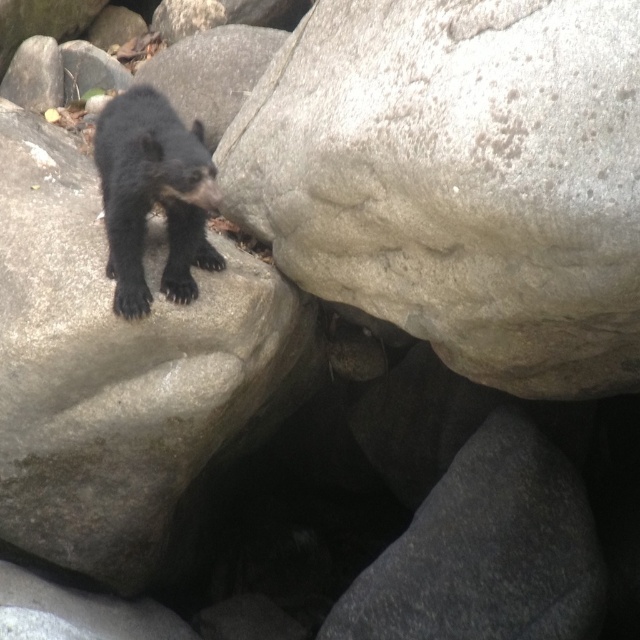
Does gray rough boulder at center appear on the right side of shiny black bear at upper left?

Indeed, gray rough boulder at center is positioned on the right side of shiny black bear at upper left.

Is the position of gray rough boulder at center more distant than that of shiny black bear at upper left?

No, gray rough boulder at center is closer to the viewer.

You are a GUI agent. You are given a task and a screenshot of the screen. Output one action in this format:
    pyautogui.click(x=<x>, y=<y>)
    Task: Click on the gray rough boulder at center
    This screenshot has width=640, height=640.
    Given the screenshot: What is the action you would take?
    pyautogui.click(x=458, y=179)

Between matte gray rock at center and shiny black bear at upper left, which one has less height?

shiny black bear at upper left is shorter.

Can you confirm if matte gray rock at center is positioned above shiny black bear at upper left?

No.

Image resolution: width=640 pixels, height=640 pixels. Find the location of `matte gray rock at center`. matte gray rock at center is located at coordinates (124, 376).

Which is in front, point (544, 296) or point (16, 132)?

Point (544, 296)

This screenshot has height=640, width=640. What do you see at coordinates (458, 179) in the screenshot?
I see `gray rough boulder at center` at bounding box center [458, 179].

Is point (508, 173) positioned behind point (129, 349)?

No, it is not.

Where is `gray rough boulder at center`? gray rough boulder at center is located at coordinates (458, 179).